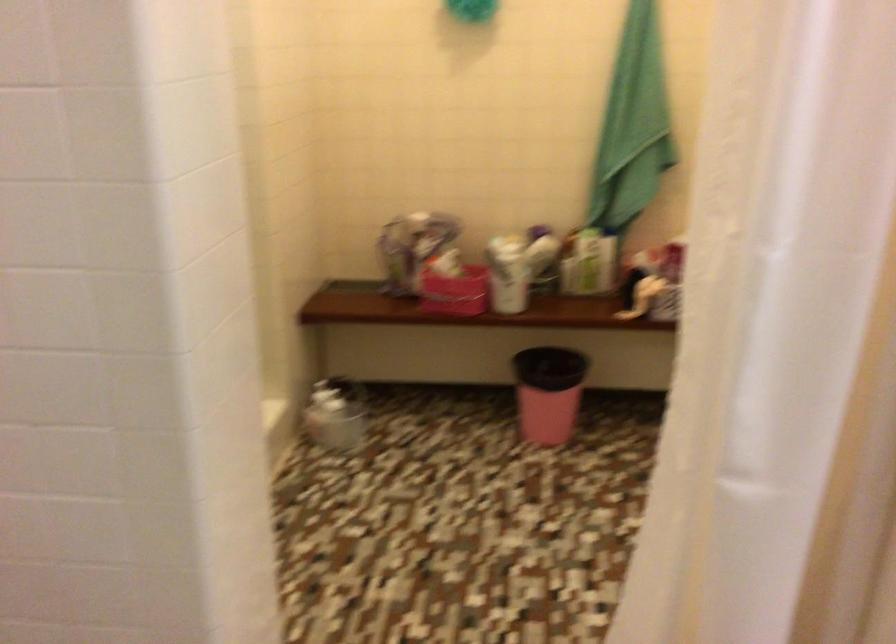
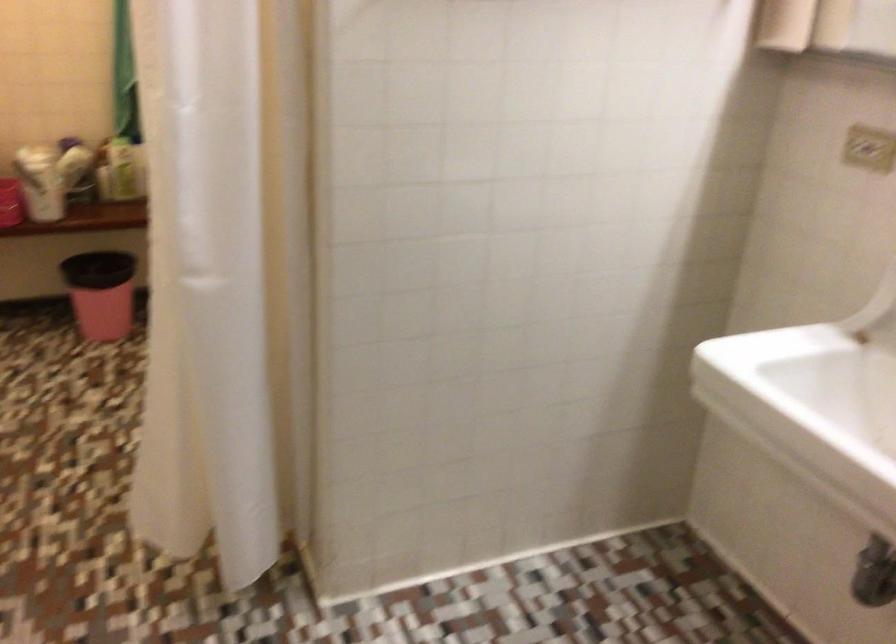
In the second image, find the point that corresponds to the point at 545,257 in the first image.

(74, 165)